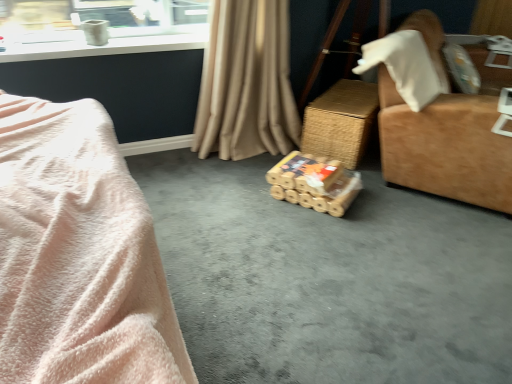
Image resolution: width=512 pixels, height=384 pixels. In order to click on empty space that is to the right of bamboo-textured toy at center in this screenshot , I will do `click(385, 203)`.